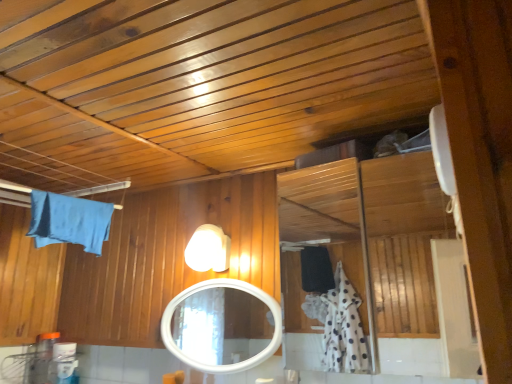
Question: Could you tell me if white glossy light fixture at upper center is turned towards white glossy mirror at center?

Choices:
 (A) no
 (B) yes

Answer: (A)

Question: Is white glossy light fixture at upper center wider than white glossy mirror at center?

Choices:
 (A) no
 (B) yes

Answer: (B)

Question: Does white glossy light fixture at upper center lie behind white glossy mirror at center?

Choices:
 (A) yes
 (B) no

Answer: (A)

Question: Would you consider white glossy light fixture at upper center to be distant from white glossy mirror at center?

Choices:
 (A) yes
 (B) no

Answer: (A)

Question: From the image's perspective, would you say white glossy light fixture at upper center is positioned over white glossy mirror at center?

Choices:
 (A) no
 (B) yes

Answer: (B)

Question: Is white glossy light fixture at upper center shorter than white glossy mirror at center?

Choices:
 (A) yes
 (B) no

Answer: (A)

Question: Is blue fabric bath towel at upper left in contact with white glossy exhaust hood at upper right?

Choices:
 (A) yes
 (B) no

Answer: (B)

Question: From the image's perspective, is blue fabric bath towel at upper left under white glossy exhaust hood at upper right?

Choices:
 (A) yes
 (B) no

Answer: (A)

Question: Would you say blue fabric bath towel at upper left is a long distance from white glossy exhaust hood at upper right?

Choices:
 (A) no
 (B) yes

Answer: (A)

Question: Is blue fabric bath towel at upper left positioned behind white glossy exhaust hood at upper right?

Choices:
 (A) yes
 (B) no

Answer: (A)

Question: Does blue fabric bath towel at upper left have a greater width compared to white glossy exhaust hood at upper right?

Choices:
 (A) no
 (B) yes

Answer: (A)

Question: Is blue fabric bath towel at upper left thinner than white glossy exhaust hood at upper right?

Choices:
 (A) yes
 (B) no

Answer: (A)

Question: Is blue fabric bath towel at upper left not close to white glossy light fixture at upper center?

Choices:
 (A) no
 (B) yes

Answer: (A)